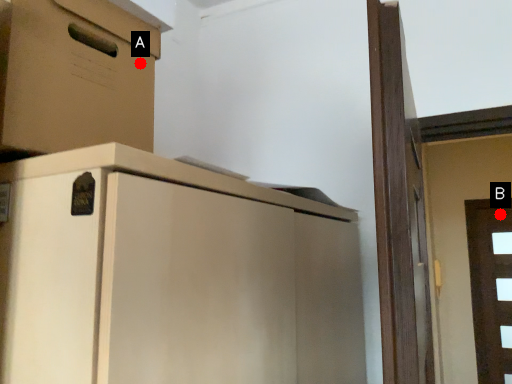
Question: Two points are circled on the image, labeled by A and B beside each circle. Which point appears farthest from the camera in this image?

Choices:
 (A) A is further
 (B) B is further

Answer: (B)